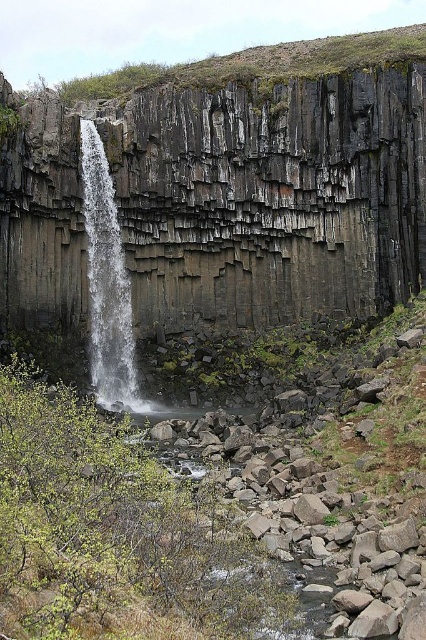
You are a geologist studying the rock formations in the image. You observe the dark gray basalt at center and the white textured waterfall at left. Which of these two features has a greater vertical height?

The dark gray basalt at center is much taller than the white textured waterfall at left, so the dark gray basalt at center has a greater vertical height.

You are a geologist examining the waterfall scene. You notice the dark gray basalt at center and the gray rocky creek at lower center. Which of these two geological formations is taller?

The dark gray basalt at center is taller than the gray rocky creek at lower center.